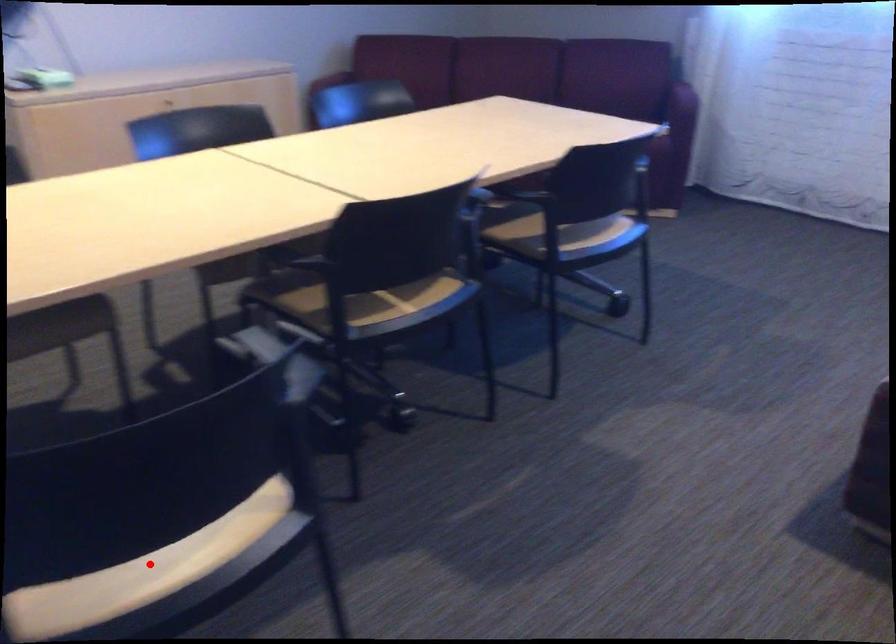
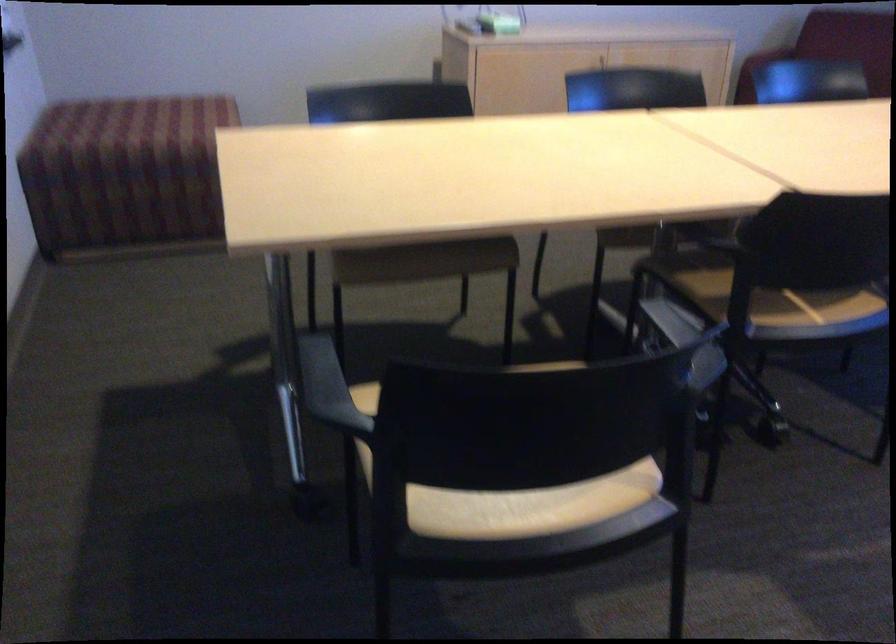
In the second image, find the point that corresponds to the highlighted location in the first image.

(515, 509)